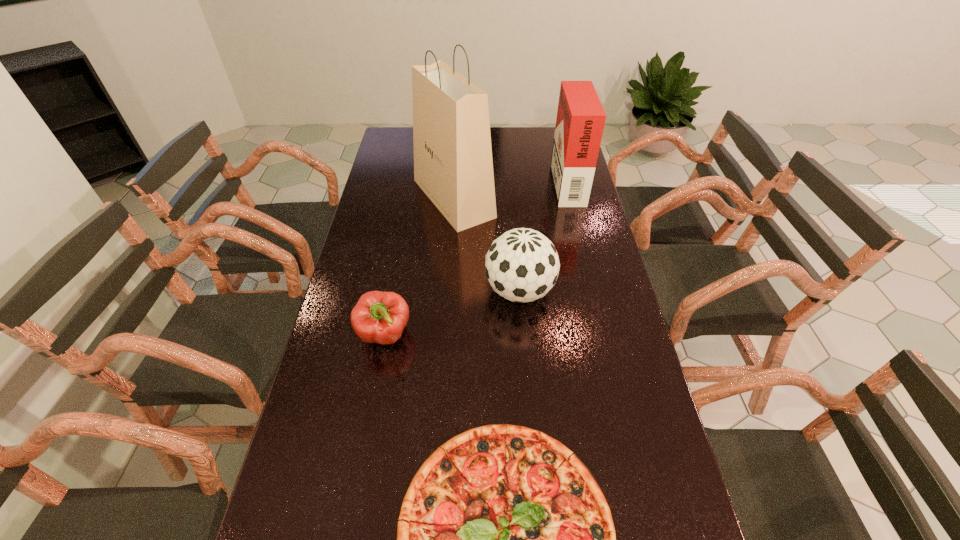
At what (x,y) coordinates should I click in order to perform the action: click on free point located 0.350m on the back of the fourth tallest object. Please return your answer as a coordinate pair (x, y). Looking at the image, I should click on (403, 235).

The image size is (960, 540). I want to click on shopping bag positioned at the left edge, so click(x=453, y=165).

I want to click on bell pepper that is positioned at the left edge, so (x=379, y=317).

Where is `object that is positioned at the right edge`? The height and width of the screenshot is (540, 960). object that is positioned at the right edge is located at coordinates (580, 121).

This screenshot has width=960, height=540. I want to click on vacant space at the left edge of the desktop, so tap(330, 342).

In order to click on vacant space at the right edge of the desktop in this screenshot , I will do `click(633, 409)`.

Find the location of a particular element. The height and width of the screenshot is (540, 960). vacant space at the far right corner is located at coordinates (539, 136).

At what (x,y) coordinates should I click in order to perform the action: click on vacant space that is in between the fourth tallest object and the soccer ball. Please return your answer as a coordinate pair (x, y). The width and height of the screenshot is (960, 540). Looking at the image, I should click on (452, 313).

I want to click on free space that is in between the tallest object and the bell pepper, so click(420, 266).

The height and width of the screenshot is (540, 960). Find the location of `vacant space in between the tallest object and the soccer ball`. vacant space in between the tallest object and the soccer ball is located at coordinates (487, 245).